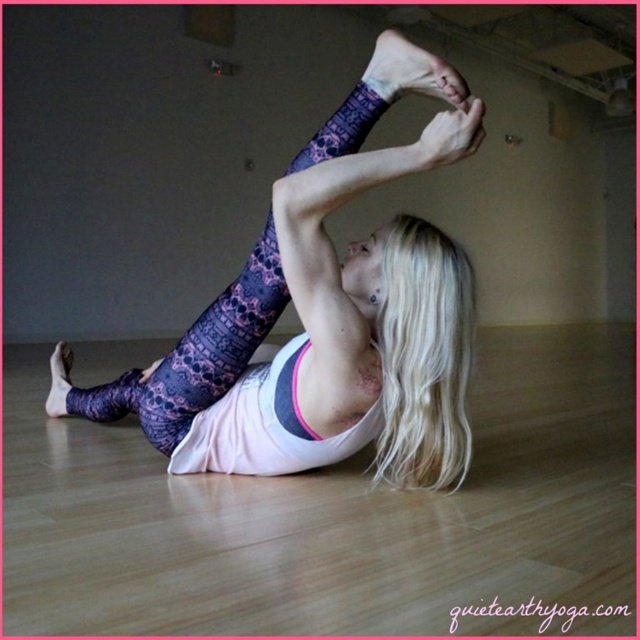
You are a photographer setting up a shoot in this yoga scene. You need to place a small prop exactly where the purple printed leggings at center are located. What coordinates should you use for the prop placement?

The coordinates for the purple printed leggings at center are point [337,314].

You are a photographer setting up a shoot in the room where the yoga pose is being performed. You want to place a small prop between the purple printed leggings at center and the purple printed sock at lower left. Based on the scene description, where should you position the prop relative to the sock?

The prop should be placed to the right of the purple printed sock at lower left since the purple printed leggings at center is located to the right of the sock, so placing the prop between them would require positioning it to the right of the sock.

You are a photographer setting up for a yoga session. You need to place a small prop between the purple printed leggings at center and the purple printed sock at lower left. What is the minimum distance you should maintain between these two items to ensure the prop fits comfortably?

The minimum distance should be at least 21.45 inches to accommodate the space between the purple printed leggings at center and the purple printed sock at lower left.